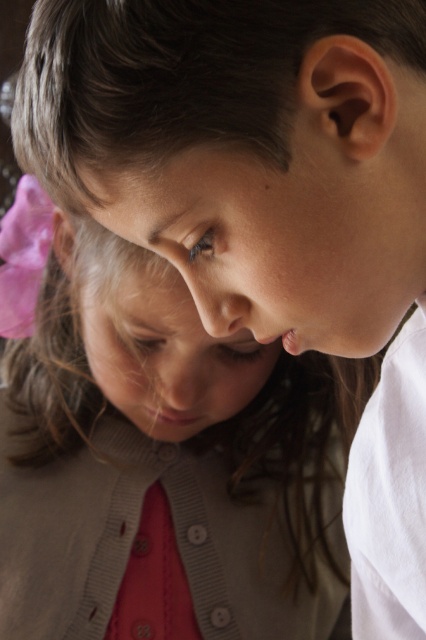
Question: Which point is closer to the camera?

Choices:
 (A) (138, 435)
 (B) (51, 115)

Answer: (B)

Question: Among these objects, which one is nearest to the camera?

Choices:
 (A) pink fabric hairband at upper left
 (B) matte pink bow at upper left

Answer: (B)

Question: Does pink fabric hairband at upper left lie behind matte pink bow at upper left?

Choices:
 (A) no
 (B) yes

Answer: (B)

Question: Is the position of pink fabric hairband at upper left less distant than that of matte pink bow at upper left?

Choices:
 (A) no
 (B) yes

Answer: (A)

Question: Among these points, which one is farthest from the camera?

Choices:
 (A) (377, 221)
 (B) (42, 525)

Answer: (B)

Question: Can you confirm if pink fabric hairband at upper left is positioned below matte pink bow at upper left?

Choices:
 (A) no
 (B) yes

Answer: (B)